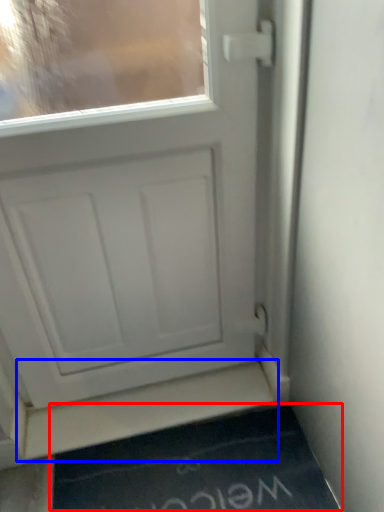
Question: Which point is further to the camera, doormat (highlighted by a red box) or stairwell (highlighted by a blue box)?

Choices:
 (A) doormat
 (B) stairwell

Answer: (B)